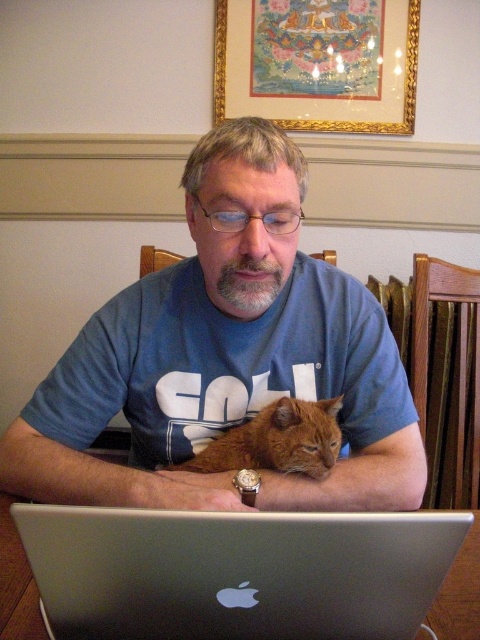
You are a photographer standing in front of the scene described. You want to take a closeup photo of the blue cotton shirt at center. Considering the distance between you and the shirt, is it possible to capture the shirt in focus without moving closer?

The blue cotton shirt at center is 26.55 inches away from the camera. Since this distance is within a typical focusing range for most cameras, you can capture the blue cotton shirt at center in focus without needing to move closer.

Based on the scene description, can you determine which object is positioned higher between the blue cotton shirt at center and the orange fur cat at center?

The blue cotton shirt at center is located above the orange fur cat at center according to the description.

You are trying to locate the silver metallic laptop at lower center in the image. According to the coordinates provided in the Objects Description, what are the exact coordinates where it is positioned?

The silver metallic laptop at lower center is located at point (x=237, y=572).